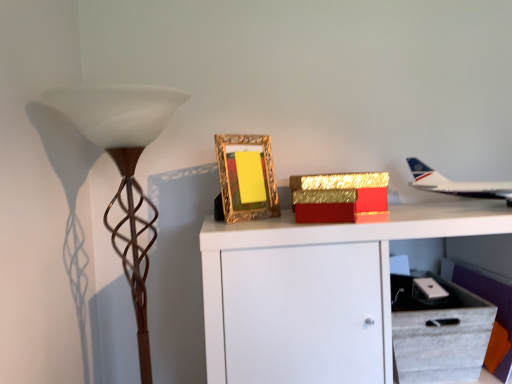
Question: Based on their sizes in the image, would you say brown textured floor lamp at left is bigger or smaller than gold ornate frame at center?

Choices:
 (A) big
 (B) small

Answer: (A)

Question: From their relative heights in the image, would you say brown textured floor lamp at left is taller or shorter than gold ornate frame at center?

Choices:
 (A) short
 (B) tall

Answer: (B)

Question: Estimate the real-world distances between objects in this image. Which object is closer to the brown textured floor lamp at left?

Choices:
 (A) gold glittery box at upper center
 (B) gold ornate frame at center
 (C) white glossy airplane at upper right
 (D) white fabric drawer at lower right

Answer: (B)

Question: Based on their relative distances, which object is nearer to the white fabric drawer at lower right?

Choices:
 (A) gold ornate frame at center
 (B) brown textured floor lamp at left
 (C) white glossy airplane at upper right
 (D) gold glittery box at upper center

Answer: (D)